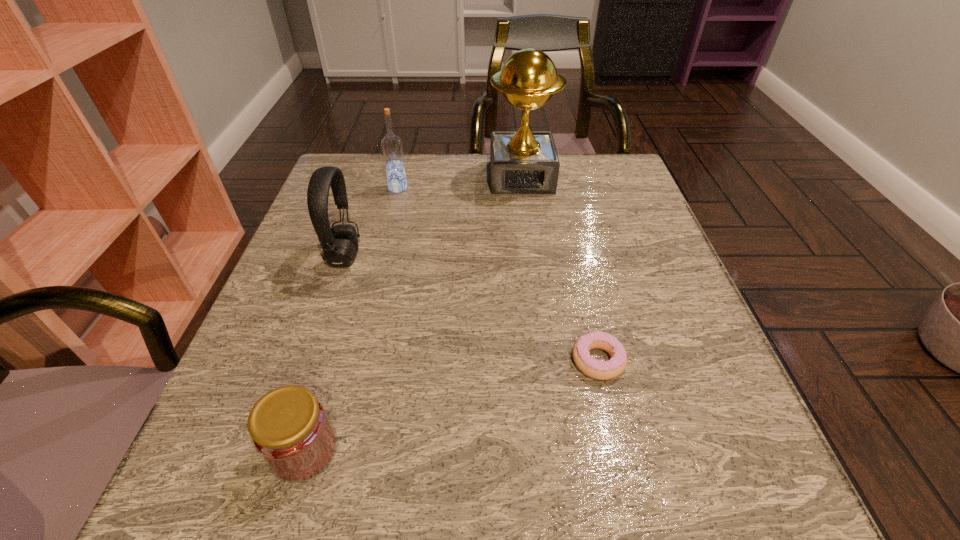
Identify the location of free point at the near edge. This screenshot has height=540, width=960. (543, 515).

Identify the location of free space at the left edge. Image resolution: width=960 pixels, height=540 pixels. (279, 386).

Locate an element on the screen. free space at the right edge of the desktop is located at coordinates (637, 350).

Where is `vacant space at the far left corner`? vacant space at the far left corner is located at coordinates (350, 183).

Find the location of a particular element. The image size is (960, 540). vacant space at the near left corner of the desktop is located at coordinates (238, 480).

Locate an element on the screen. Image resolution: width=960 pixels, height=540 pixels. free spot between the shortest object and the nearest object is located at coordinates (451, 406).

The image size is (960, 540). I want to click on vacant area that lies between the vodka and the award, so click(460, 183).

Find the location of a particular element. unoccupied position between the doughnut and the award is located at coordinates (560, 269).

You are a GUI agent. You are given a task and a screenshot of the screen. Output one action in this format:
    pyautogui.click(x=<x>, y=<y>)
    Task: Click on the unoccupied area between the vodka and the award
    This screenshot has height=540, width=960.
    Given the screenshot: What is the action you would take?
    pyautogui.click(x=460, y=183)

The width and height of the screenshot is (960, 540). In order to click on empty location between the headset and the award in this screenshot , I will do [x=433, y=217].